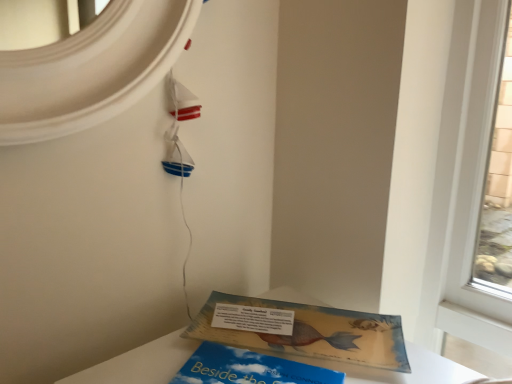
Question: From a real-world perspective, is blue matte book at lower center, marked as the 1th book in a front-to-back arrangement, physically located above or below matte yellow book at lower center, the second book viewed from the front?

Choices:
 (A) below
 (B) above

Answer: (A)

Question: Is blue matte book at lower center, marked as the 1th book in a front-to-back arrangement, spatially inside matte yellow book at lower center, the second book viewed from the front, or outside of it?

Choices:
 (A) outside
 (B) inside

Answer: (A)

Question: Based on their relative distances, which object is nearer to the blue matte book at lower center, acting as the 2th book starting from the back?

Choices:
 (A) white paper at lower center
 (B) matte yellow book at lower center, which appears as the 1th book when viewed from the back

Answer: (B)

Question: Which object is the closest to the matte yellow book at lower center, the second book viewed from the front?

Choices:
 (A) blue matte book at lower center, acting as the 2th book starting from the back
 (B) white paper at lower center

Answer: (B)